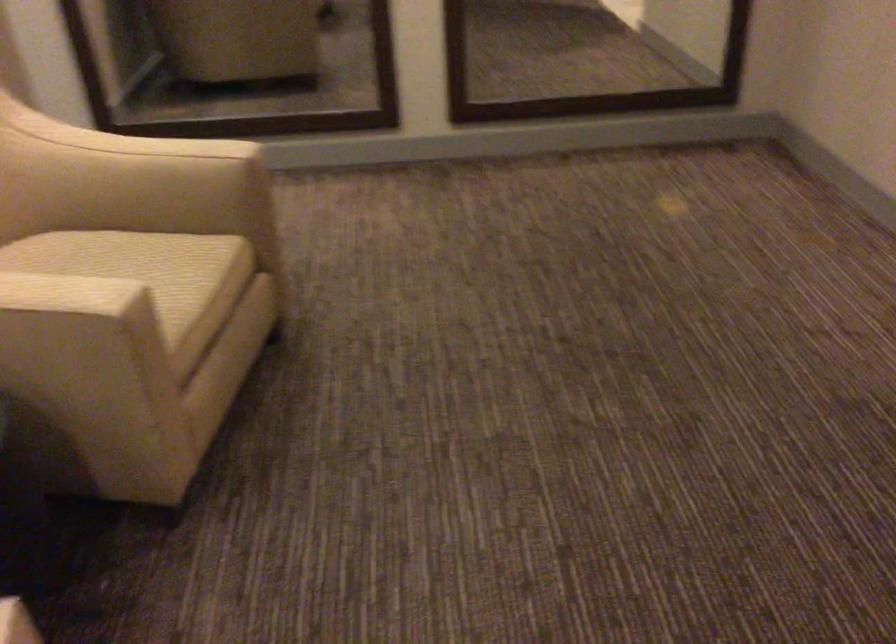
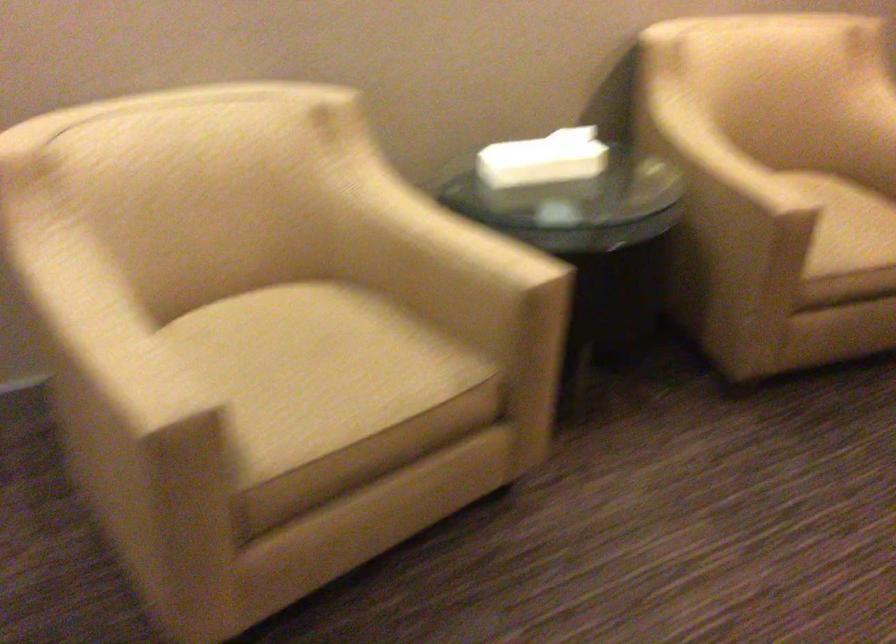
Based on the continuous images, in which direction is the camera rotating?

The camera rotated toward left-down.